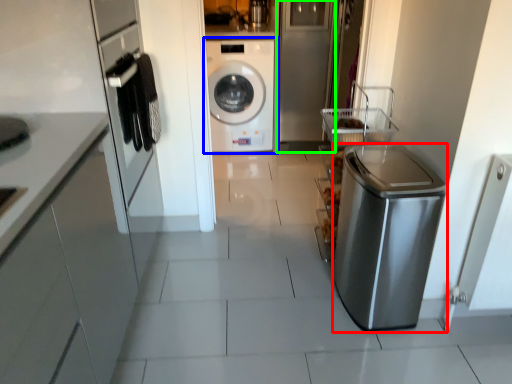
Question: Which is farther away from dish washer (highlighted by a red box)? washing machine (highlighted by a blue box) or glass door (highlighted by a green box)?

Choices:
 (A) washing machine
 (B) glass door

Answer: (A)